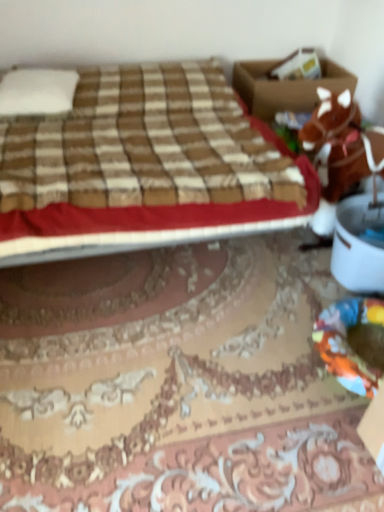
Question: Could white soft pillow at upper left be considered to be inside brown plush horse at right?

Choices:
 (A) yes
 (B) no

Answer: (B)

Question: Is brown plush horse at right closer to the viewer compared to white soft pillow at upper left?

Choices:
 (A) yes
 (B) no

Answer: (A)

Question: Can you confirm if brown plush horse at right is smaller than white soft pillow at upper left?

Choices:
 (A) yes
 (B) no

Answer: (B)

Question: Is brown plush horse at right aimed at white soft pillow at upper left?

Choices:
 (A) no
 (B) yes

Answer: (A)

Question: Is brown plush horse at right at the right side of white soft pillow at upper left?

Choices:
 (A) yes
 (B) no

Answer: (A)

Question: Is brown cardboard box at upper right situated inside white soft pillow at upper left or outside?

Choices:
 (A) outside
 (B) inside

Answer: (A)

Question: Is brown cardboard box at upper right taller or shorter than white soft pillow at upper left?

Choices:
 (A) tall
 (B) short

Answer: (A)

Question: From a real-world perspective, relative to white soft pillow at upper left, is brown cardboard box at upper right vertically above or below?

Choices:
 (A) below
 (B) above

Answer: (A)

Question: Considering the positions of brown cardboard box at upper right and white soft pillow at upper left in the image, is brown cardboard box at upper right bigger or smaller than white soft pillow at upper left?

Choices:
 (A) small
 (B) big

Answer: (B)

Question: From the image's perspective, is brown plush horse at right positioned above or below white soft pillow at upper left?

Choices:
 (A) above
 (B) below

Answer: (B)

Question: Is brown plush horse at right in front of or behind white soft pillow at upper left in the image?

Choices:
 (A) front
 (B) behind

Answer: (A)

Question: From a real-world perspective, is brown plush horse at right positioned above or below white soft pillow at upper left?

Choices:
 (A) below
 (B) above

Answer: (A)

Question: Looking at the image, does brown plush horse at right seem bigger or smaller compared to white soft pillow at upper left?

Choices:
 (A) big
 (B) small

Answer: (A)

Question: Considering the positions of brown plaid bed at upper left and brown cardboard box at upper right in the image, is brown plaid bed at upper left taller or shorter than brown cardboard box at upper right?

Choices:
 (A) short
 (B) tall

Answer: (B)

Question: From a real-world perspective, relative to brown cardboard box at upper right, is brown plaid bed at upper left vertically above or below?

Choices:
 (A) below
 (B) above

Answer: (B)